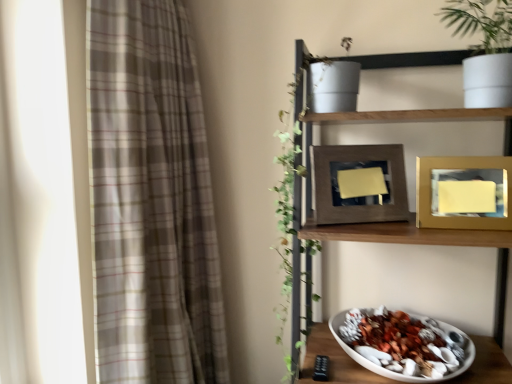
What is the approximate height of wooden shelf at upper right?

It is 1.08 meters.

In order to face wooden shelf at upper right, should I rotate leftwards or rightwards?

You should look right and rotate roughly 20.297 degrees.

What do you see at coordinates (151, 200) in the screenshot? The width and height of the screenshot is (512, 384). I see `plaid fabric curtain at left` at bounding box center [151, 200].

In order to face white matte bowl at lower right, should I rotate leftwards or rightwards?

A 18.866 degree turn to the right will do.

The image size is (512, 384). I want to click on wooden frame at center, which ranks as the first picture frame in left-to-right order, so click(359, 184).

Which is in front, point (335, 190) or point (425, 336)?

The point (335, 190) is closer.

Which object is further away from the camera taking this photo, wooden frame at center, arranged as the second picture frame when viewed from the right, or white matte bowl at lower right?

wooden frame at center, arranged as the second picture frame when viewed from the right, is further from the camera.

Is wooden frame at center, arranged as the second picture frame when viewed from the right, outside of white matte bowl at lower right?

Yes, wooden frame at center, arranged as the second picture frame when viewed from the right, is located beyond the bounds of white matte bowl at lower right.

Looking at their sizes, would you say wooden frame at center, which ranks as the first picture frame in left-to-right order, is wider or thinner than white matte bowl at lower right?

In the image, wooden frame at center, which ranks as the first picture frame in left-to-right order, appears to be more narrow than white matte bowl at lower right.

Is point (437, 330) closer or farther from the camera than point (452, 180)?

Point (437, 330) is positioned farther from the camera compared to point (452, 180).

Which is more to the left, white matte bowl at lower right or gold metallic picture frame at upper right, which is the second picture frame in left-to-right order?

white matte bowl at lower right is more to the left.

Which of these two, white matte bowl at lower right or gold metallic picture frame at upper right, which is the second picture frame in left-to-right order, is smaller?

Smaller between the two is gold metallic picture frame at upper right, which is the second picture frame in left-to-right order.

How different are the orientations of white matte bowl at lower right and gold metallic picture frame at upper right, which is the second picture frame in left-to-right order, in degrees?

They differ by 3.2 degrees in their facing directions.

Based on the photo, does wooden shelf at upper right touch plaid fabric curtain at left?

No, wooden shelf at upper right is not next to plaid fabric curtain at left.

From a real-world perspective, is wooden shelf at upper right over plaid fabric curtain at left?

No, from a real-world perspective, wooden shelf at upper right is not above plaid fabric curtain at left.

Between point (467, 237) and point (96, 71), which one is positioned behind?

The point (96, 71) is more distant.

Which of these two, wooden shelf at upper right or plaid fabric curtain at left, stands taller?

plaid fabric curtain at left.

Is plaid fabric curtain at left far away from wooden frame at center, arranged as the second picture frame when viewed from the right?

No.

Considering the positions of objects plaid fabric curtain at left and wooden frame at center, which ranks as the first picture frame in left-to-right order, in the image provided, who is in front, plaid fabric curtain at left or wooden frame at center, which ranks as the first picture frame in left-to-right order,?

plaid fabric curtain at left.

Which of these two, plaid fabric curtain at left or wooden frame at center, arranged as the second picture frame when viewed from the right, is smaller?

wooden frame at center, arranged as the second picture frame when viewed from the right.

Is plaid fabric curtain at left facing away from wooden frame at center, which ranks as the first picture frame in left-to-right order?

Yes, plaid fabric curtain at left is positioned with its back facing wooden frame at center, which ranks as the first picture frame in left-to-right order.

Considering the sizes of objects wooden frame at center, which ranks as the first picture frame in left-to-right order, and gold metallic picture frame at upper right, which ranks as the 1th picture frame in right-to-left order, in the image provided, who is bigger, wooden frame at center, which ranks as the first picture frame in left-to-right order, or gold metallic picture frame at upper right, which ranks as the 1th picture frame in right-to-left order,?

wooden frame at center, which ranks as the first picture frame in left-to-right order.

Looking at this image, which object is closer to the camera taking this photo, wooden frame at center, which ranks as the first picture frame in left-to-right order, or gold metallic picture frame at upper right, which is the second picture frame in left-to-right order?

Positioned in front is gold metallic picture frame at upper right, which is the second picture frame in left-to-right order.

Consider the image. Would you say wooden frame at center, which ranks as the first picture frame in left-to-right order, is a long distance from gold metallic picture frame at upper right, which is the second picture frame in left-to-right order?

No, there isn't a large distance between wooden frame at center, which ranks as the first picture frame in left-to-right order, and gold metallic picture frame at upper right, which is the second picture frame in left-to-right order.

Considering the points (333, 193) and (459, 188), which point is in front, point (333, 193) or point (459, 188)?

Positioned in front is point (459, 188).

Which of these two, gold metallic picture frame at upper right, which ranks as the 1th picture frame in right-to-left order, or plaid fabric curtain at left, is wider?

plaid fabric curtain at left.

Is gold metallic picture frame at upper right, which ranks as the 1th picture frame in right-to-left order, positioned behind plaid fabric curtain at left?

Yes, gold metallic picture frame at upper right, which ranks as the 1th picture frame in right-to-left order, is further from the viewer.

In the scene shown: Is there a large distance between gold metallic picture frame at upper right, which is the second picture frame in left-to-right order, and plaid fabric curtain at left?

No, there isn't a large distance between gold metallic picture frame at upper right, which is the second picture frame in left-to-right order, and plaid fabric curtain at left.

How many degrees apart are the facing directions of gold metallic picture frame at upper right, which is the second picture frame in left-to-right order, and plaid fabric curtain at left?

84.8 degrees separate the facing orientations of gold metallic picture frame at upper right, which is the second picture frame in left-to-right order, and plaid fabric curtain at left.

From a real-world perspective, which object stands above the other?

From a 3D spatial view, gold metallic picture frame at upper right, which is the second picture frame in left-to-right order, is above.

Is gold metallic picture frame at upper right, which ranks as the 1th picture frame in right-to-left order, beside wooden shelf at upper right?

They are not placed beside each other.

Which is correct: gold metallic picture frame at upper right, which ranks as the 1th picture frame in right-to-left order, is inside wooden shelf at upper right, or outside of it?

gold metallic picture frame at upper right, which ranks as the 1th picture frame in right-to-left order, is enclosed within wooden shelf at upper right.

Could you tell me if gold metallic picture frame at upper right, which is the second picture frame in left-to-right order, is facing wooden shelf at upper right?

Yes, gold metallic picture frame at upper right, which is the second picture frame in left-to-right order, is oriented towards wooden shelf at upper right.

The height and width of the screenshot is (384, 512). I want to click on food on the right side of wooden frame at center, which ranks as the first picture frame in left-to-right order, so click(x=403, y=344).

From the white matte bowl at lower right, count 1st picture frames backward and point to it. Please provide its 2D coordinates.

[(464, 193)]

Estimate the real-world distances between objects in this image. Which object is further from plaid fabric curtain at left, wooden frame at center, arranged as the second picture frame when viewed from the right, or white matte bowl at lower right?

white matte bowl at lower right.

Based on their spatial positions, is gold metallic picture frame at upper right, which ranks as the 1th picture frame in right-to-left order, or white matte bowl at lower right further from plaid fabric curtain at left?

gold metallic picture frame at upper right, which ranks as the 1th picture frame in right-to-left order, is positioned further to the anchor plaid fabric curtain at left.

Considering their positions, is plaid fabric curtain at left positioned further to wooden frame at center, arranged as the second picture frame when viewed from the right, than wooden shelf at upper right?

The object further to wooden frame at center, arranged as the second picture frame when viewed from the right, is plaid fabric curtain at left.

Which object lies nearer to the anchor point plaid fabric curtain at left, wooden shelf at upper right or white matte bowl at lower right?

wooden shelf at upper right.

Which object lies further to the anchor point gold metallic picture frame at upper right, which is the second picture frame in left-to-right order, wooden frame at center, arranged as the second picture frame when viewed from the right, or plaid fabric curtain at left?

The object further to gold metallic picture frame at upper right, which is the second picture frame in left-to-right order, is plaid fabric curtain at left.

From the image, which object appears to be nearer to gold metallic picture frame at upper right, which ranks as the 1th picture frame in right-to-left order, wooden shelf at upper right or plaid fabric curtain at left?

wooden shelf at upper right.

Considering their positions, is gold metallic picture frame at upper right, which ranks as the 1th picture frame in right-to-left order, positioned further to wooden frame at center, which ranks as the first picture frame in left-to-right order, than white matte bowl at lower right?

white matte bowl at lower right.

From the image, which object appears to be farther from white matte bowl at lower right, wooden shelf at upper right or plaid fabric curtain at left?

plaid fabric curtain at left is further to white matte bowl at lower right.

Locate an element on the screen. The width and height of the screenshot is (512, 384). shelf between gold metallic picture frame at upper right, which is the second picture frame in left-to-right order, and white matte bowl at lower right vertically is located at coordinates (410, 213).

Find the location of a particular element. food situated between plaid fabric curtain at left and gold metallic picture frame at upper right, which ranks as the 1th picture frame in right-to-left order, from left to right is located at coordinates (403, 344).

Locate an element on the screen. The width and height of the screenshot is (512, 384). picture frame located between plaid fabric curtain at left and white matte bowl at lower right in the left-right direction is located at coordinates (359, 184).

Identify the location of picture frame that lies between wooden frame at center, which ranks as the first picture frame in left-to-right order, and white matte bowl at lower right from top to bottom. This screenshot has height=384, width=512. (464, 193).